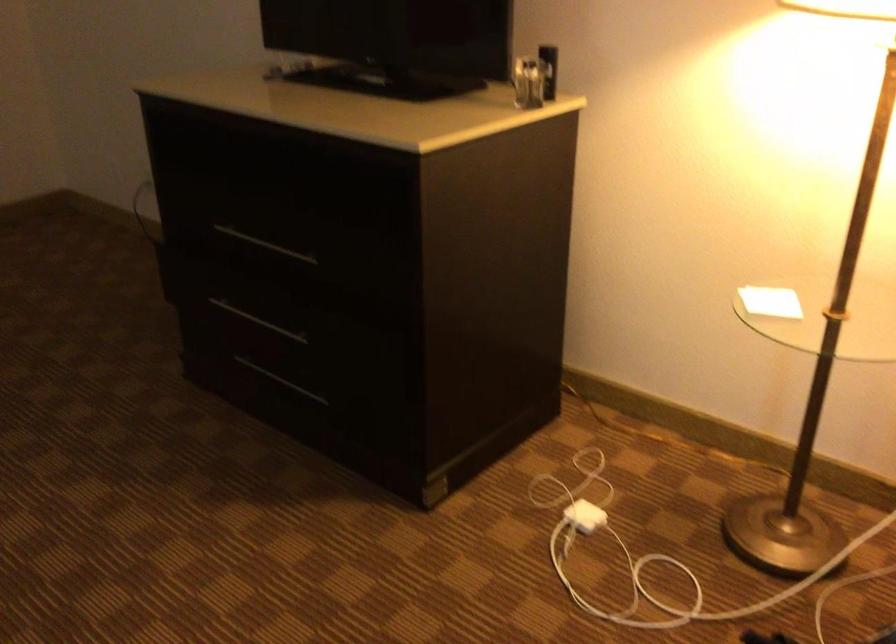
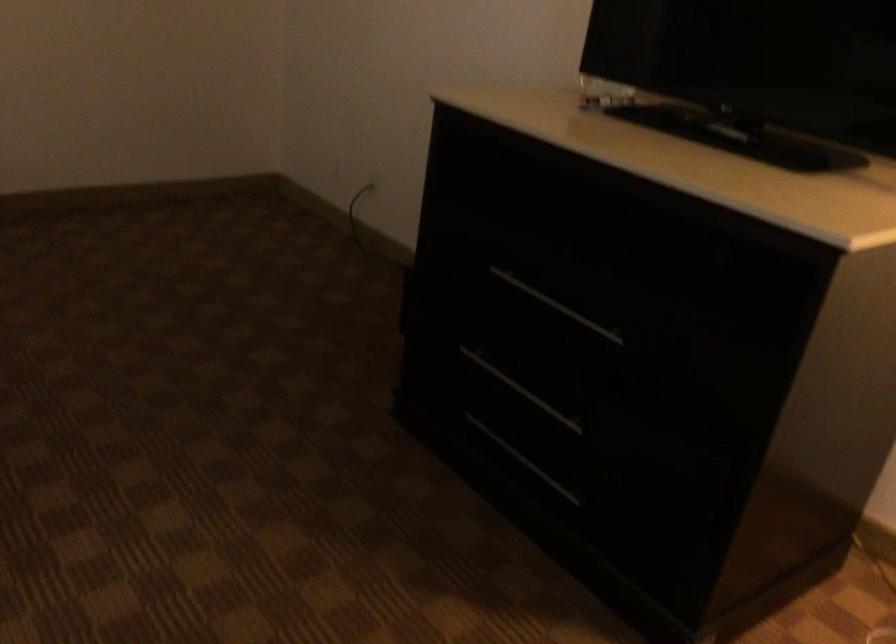
In a continuous first-person perspective shot, in which direction is the camera moving?

The cameraman walked toward left, forward.